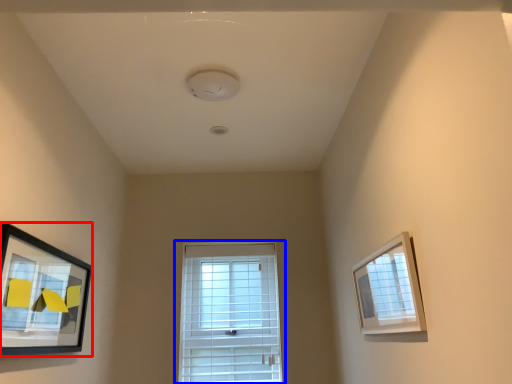
Question: Which object appears farthest to the camera in this image, picture frame (highlighted by a red box) or window (highlighted by a blue box)?

Choices:
 (A) picture frame
 (B) window

Answer: (B)